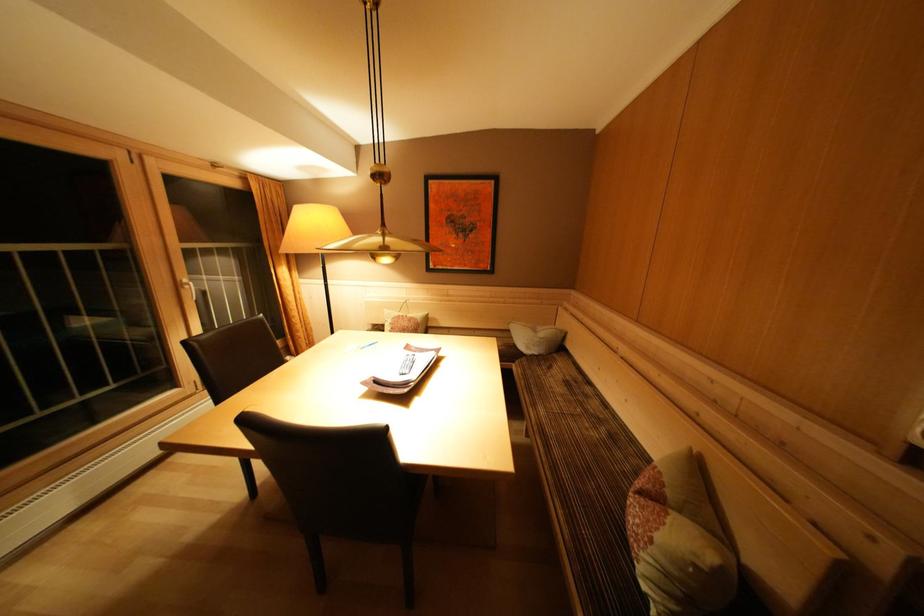
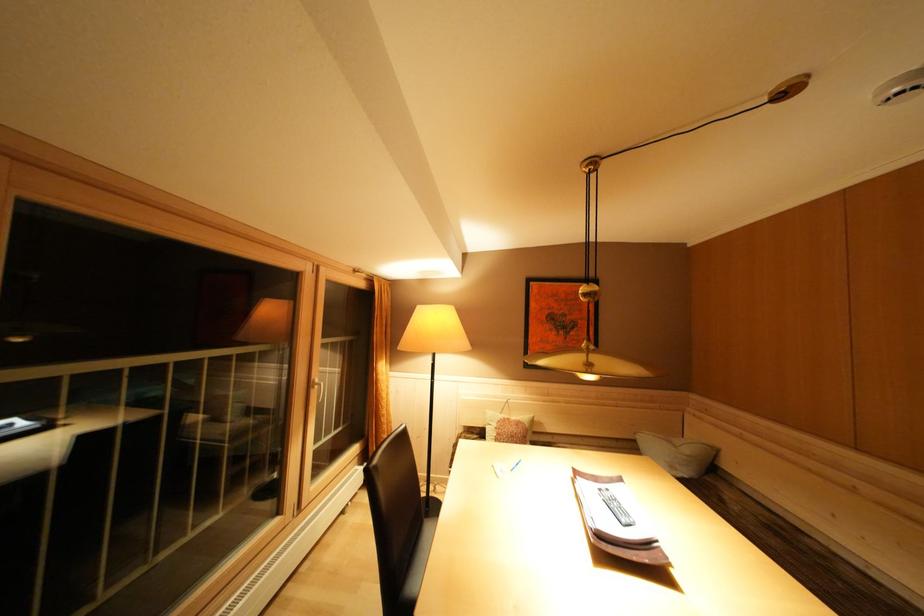
The point at [205,346] is marked in the first image. Where is the corresponding point in the second image?

(383, 472)